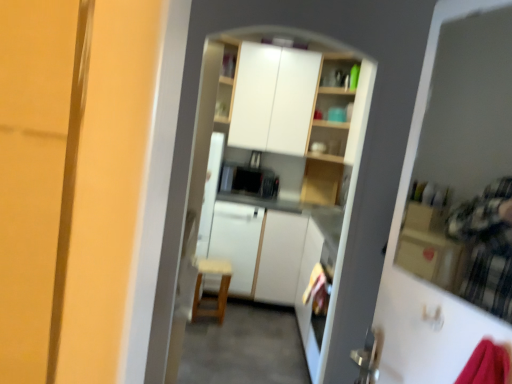
Question: In terms of size, does white glossy cabinets at upper center, the second cabinetry positioned from the bottom, appear bigger or smaller than wooden chair at center?

Choices:
 (A) small
 (B) big

Answer: (B)

Question: Does point (258, 102) appear closer or farther from the camera than point (218, 322)?

Choices:
 (A) closer
 (B) farther

Answer: (B)

Question: Estimate the real-world distances between objects in this image. Which object is closer to the transparent plastic screen door at upper right?

Choices:
 (A) white glossy cabinets at upper center, marked as the first cabinetry in a top-to-bottom arrangement
 (B) white matte cabinet at center, the second cabinetry viewed from the top
 (C) wooden chair at center

Answer: (B)

Question: Estimate the real-world distances between objects in this image. Which object is closer to the transparent plastic screen door at upper right?

Choices:
 (A) white matte cabinet at center, the second cabinetry viewed from the top
 (B) white glossy cabinets at upper center, marked as the first cabinetry in a top-to-bottom arrangement
 (C) wooden chair at center

Answer: (A)